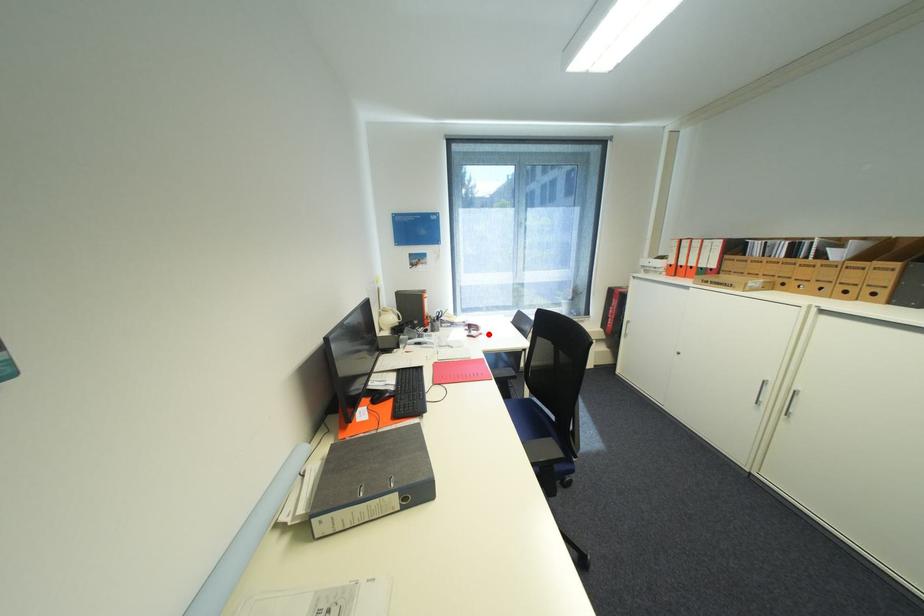
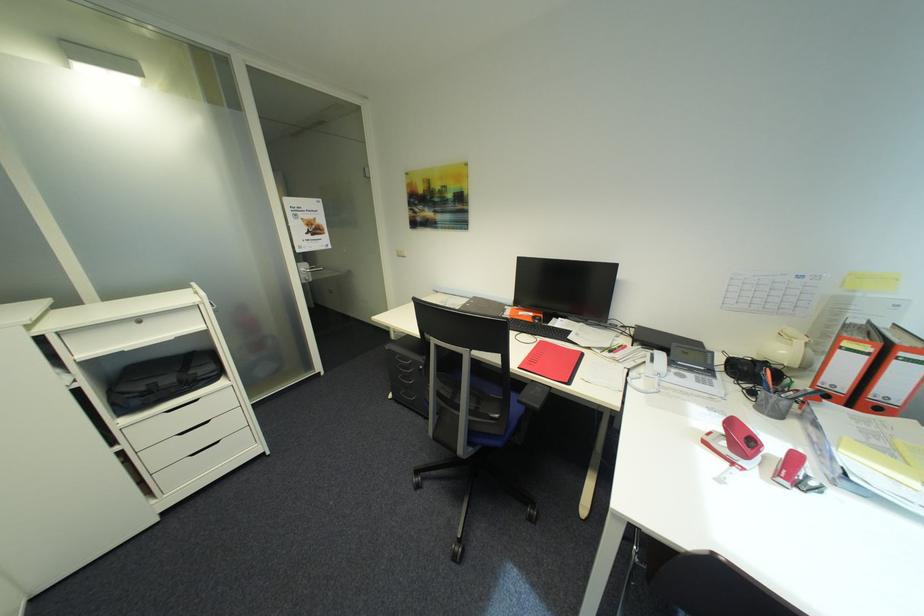
The point at the highlighted location is marked in the first image. Where is the corresponding point in the second image?

(742, 464)